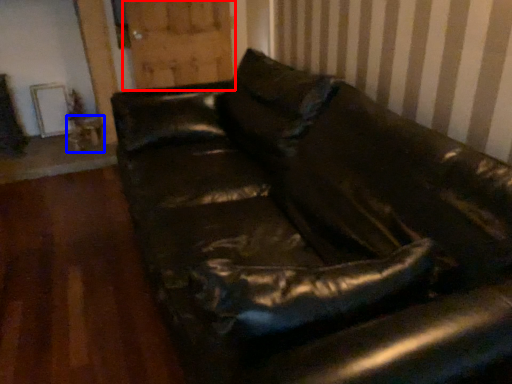
Question: Which of the following is the farthest to the observer, barn door (highlighted by a red box) or table (highlighted by a blue box)?

Choices:
 (A) barn door
 (B) table

Answer: (B)